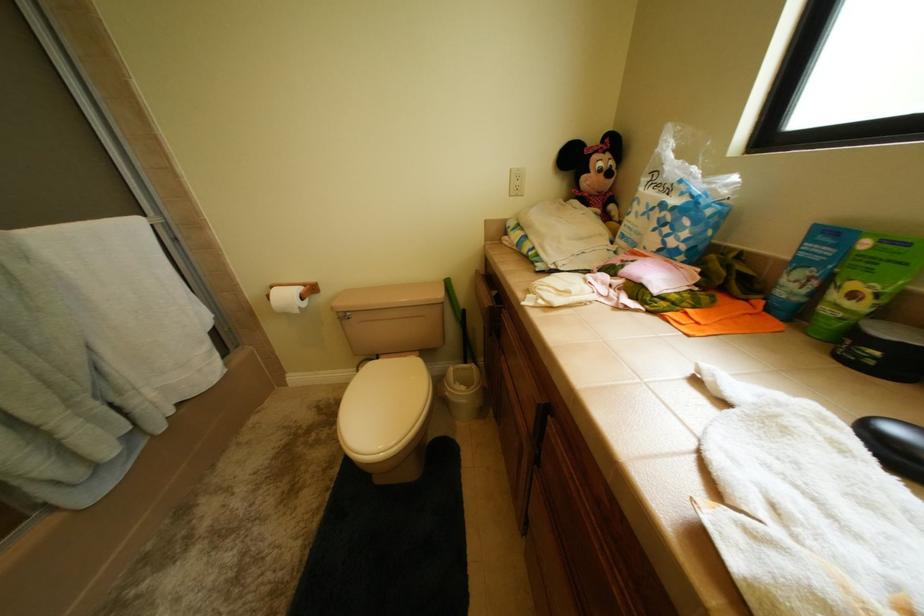
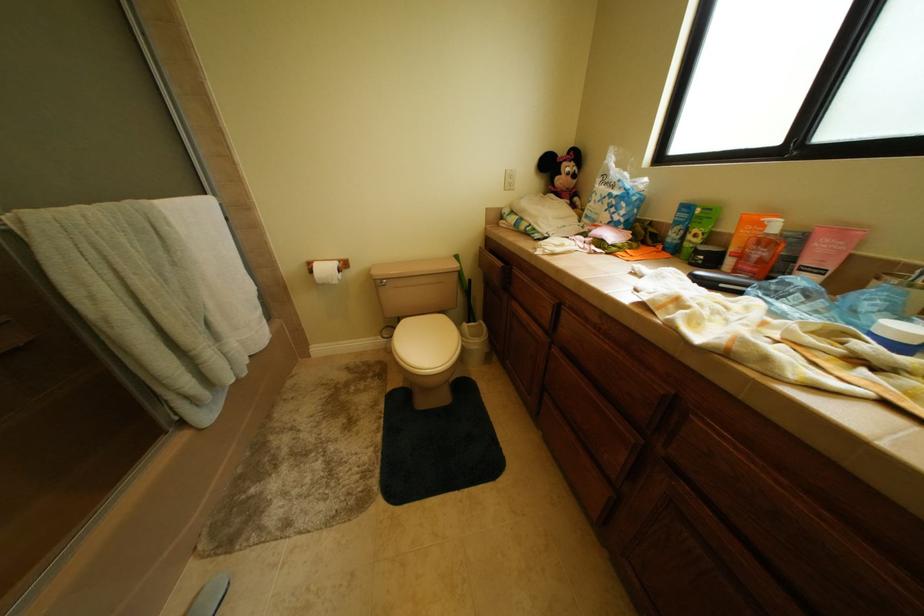
Question: The camera is either moving clockwise (left) or counter-clockwise (right) around the object. The first image is from the beginning of the video and the second image is from the end. Is the camera moving left or right when shooting the video?

Choices:
 (A) Left
 (B) Right

Answer: (A)